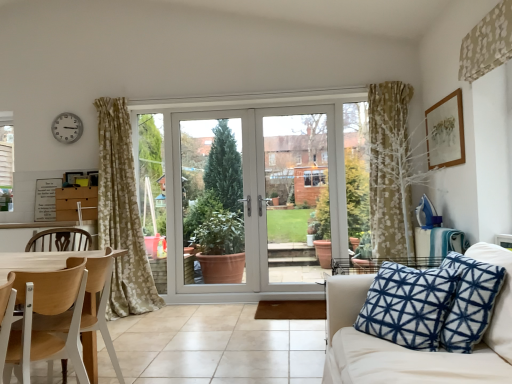
Question: Is matte silver clock at upper left bigger or smaller than beige floral fabric at upper right?

Choices:
 (A) small
 (B) big

Answer: (A)

Question: Is matte silver clock at upper left wider or thinner than beige floral fabric at upper right?

Choices:
 (A) wide
 (B) thin

Answer: (B)

Question: Which is farther from the white plastic door at center?

Choices:
 (A) wooden chair at left
 (B) white fabric couch at lower right
 (C) matte silver clock at upper left
 (D) clear glass door at center, the second screen door from the left
 (E) clear glass door at center, arranged as the 2th screen door when viewed from the right

Answer: (B)

Question: Which is farther from the wooden chair at left?

Choices:
 (A) beige floral fabric at upper right
 (B) clear glass door at center, acting as the first screen door starting from the right
 (C) clear glass door at center, acting as the first screen door starting from the left
 (D) wooden picture frame at upper right
 (E) matte silver clock at upper left

Answer: (D)